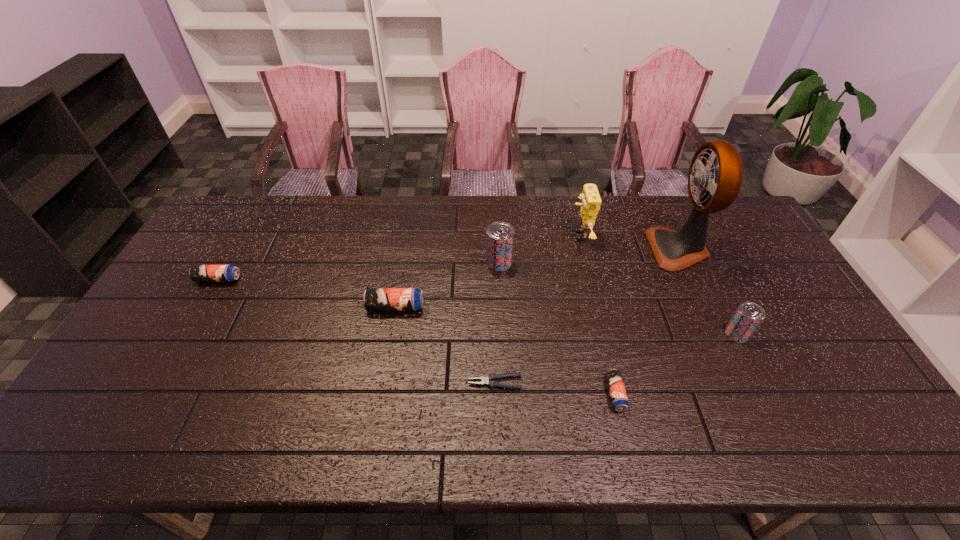
At what (x,y) coordinates should I click in order to perform the action: click on the farthest blue beer can. Please return your answer as a coordinate pair (x, y). Looking at the image, I should click on (198, 273).

You are a GUI agent. You are given a task and a screenshot of the screen. Output one action in this format:
    pyautogui.click(x=<x>, y=<y>)
    Task: Click on the rightmost blue beer can
    The height and width of the screenshot is (540, 960).
    Given the screenshot: What is the action you would take?
    pyautogui.click(x=618, y=395)

In order to click on the shortest beer can in this screenshot , I will do `click(618, 395)`.

Locate an element on the screen. gray pliers is located at coordinates (489, 380).

At what (x,y) coordinates should I click in order to perform the action: click on the shortest object. Please return your answer as a coordinate pair (x, y). Image resolution: width=960 pixels, height=540 pixels. Looking at the image, I should click on (489, 380).

Identify the location of free region located on the front-facing side of the fan. (600, 249).

Identify the location of vacant space located 0.320m on the front-facing side of the fan. (555, 249).

This screenshot has height=540, width=960. What are the coordinates of `free space located 0.100m on the front-facing side of the fan` in the screenshot? It's located at (621, 249).

Identify the location of free point located on the face of the seventh shortest object. pyautogui.click(x=496, y=236).

Where is `free space located on the face of the seventh shortest object`? free space located on the face of the seventh shortest object is located at coordinates (479, 236).